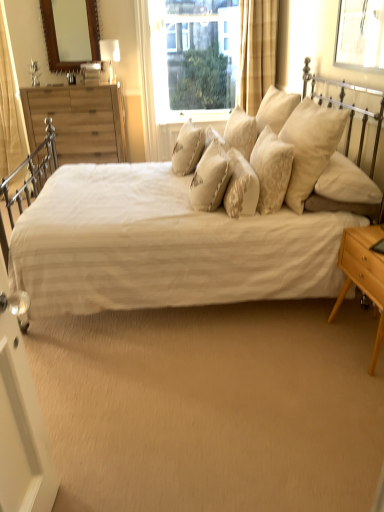
This screenshot has height=512, width=384. I want to click on free space to the left of light wood/texture nightstand at lower right, so click(x=306, y=345).